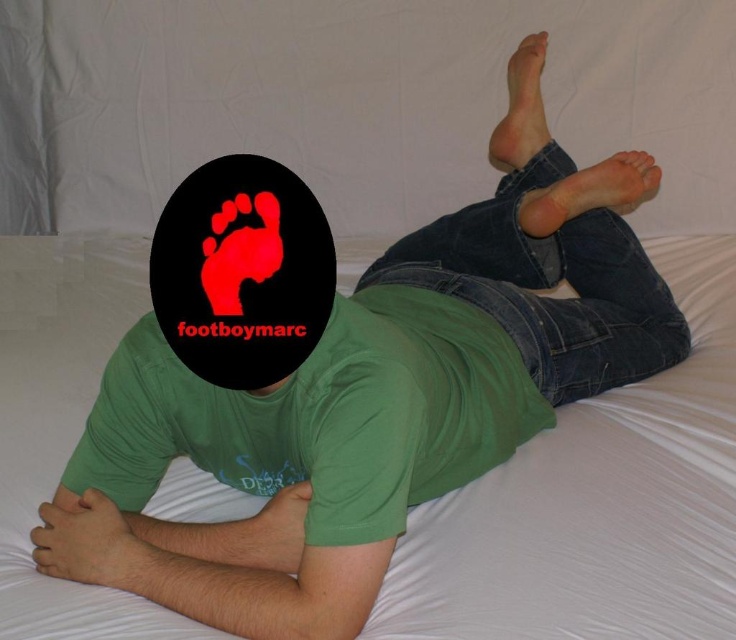
Is smooth skin hand at lower left in front of matte green t-shirt at lower center?

Yes, it is in front of matte green t-shirt at lower center.

Does smooth skin hand at lower left have a greater width compared to matte green t-shirt at lower center?

Yes.

Identify the location of smooth skin hand at lower left. (85, 541).